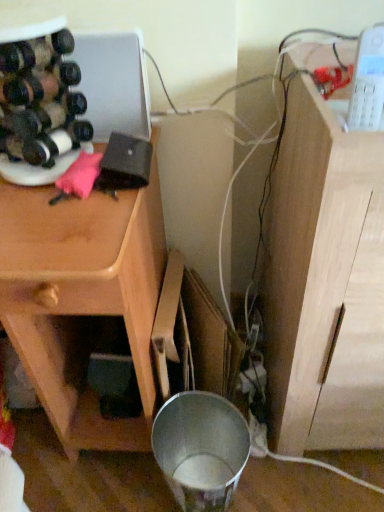
You are a GUI agent. You are given a task and a screenshot of the screen. Output one action in this format:
    pyautogui.click(x=<x>, y=<y>)
    Task: Click on the matte black wine bottle at left, arranged as the first wine bottle when viewed from the top
    The width and height of the screenshot is (384, 512).
    Given the screenshot: What is the action you would take?
    pyautogui.click(x=41, y=100)

The image size is (384, 512). Describe the element at coordinates (41, 100) in the screenshot. I see `matte black wine bottle at left, arranged as the first wine bottle when viewed from the top` at that location.

Image resolution: width=384 pixels, height=512 pixels. Identify the location of matte black wine bottle at left, the second wine bottle when ordered from top to bottom. (56, 143).

Would you say wooden cabinet at left contains light wood cabinet at right?

No, light wood cabinet at right is located outside of wooden cabinet at left.

Is wooden cabinet at left directly adjacent to light wood cabinet at right?

No, wooden cabinet at left is not next to light wood cabinet at right.

From the image's perspective, is wooden cabinet at left on top of light wood cabinet at right?

Actually, wooden cabinet at left appears below light wood cabinet at right in the image.

Can you confirm if wooden cabinet at left is thinner than light wood cabinet at right?

Correct, the width of wooden cabinet at left is less than that of light wood cabinet at right.

Identify the location of vanity in front of the matte black wine bottle at left, the second wine bottle when ordered from top to bottom. Image resolution: width=384 pixels, height=512 pixels. (325, 283).

From the picture: Does matte black wine bottle at left, positioned as the 1th wine bottle in bottom-to-top order, have a greater width compared to light wood cabinet at right?

No, matte black wine bottle at left, positioned as the 1th wine bottle in bottom-to-top order, is not wider than light wood cabinet at right.

In the image, is matte black wine bottle at left, positioned as the 1th wine bottle in bottom-to-top order, on the left side or the right side of light wood cabinet at right?

Based on their positions, matte black wine bottle at left, positioned as the 1th wine bottle in bottom-to-top order, is located to the left of light wood cabinet at right.

Which of these two, matte black wine bottle at left, positioned as the 1th wine bottle in bottom-to-top order, or light wood cabinet at right, is smaller?

With smaller size is matte black wine bottle at left, positioned as the 1th wine bottle in bottom-to-top order.

Considering the sizes of matte black wine bottle at left, arranged as the first wine bottle when viewed from the top, and light wood cabinet at right in the image, is matte black wine bottle at left, arranged as the first wine bottle when viewed from the top, bigger or smaller than light wood cabinet at right?

matte black wine bottle at left, arranged as the first wine bottle when viewed from the top, is smaller than light wood cabinet at right.

In the image, there is a matte black wine bottle at left, arranged as the first wine bottle when viewed from the top. At what (x,y) coordinates should I click in order to perform the action: click on vanity below it (from a real-world perspective). Please return your answer as a coordinate pair (x, y). This screenshot has width=384, height=512. Looking at the image, I should click on (325, 283).

Could light wood cabinet at right be considered to be inside matte black wine bottle at left, the 2th wine bottle in the bottom-to-top sequence?

No, light wood cabinet at right is not a part of matte black wine bottle at left, the 2th wine bottle in the bottom-to-top sequence.

From a real-world perspective, relative to light wood cabinet at right, is matte black wine bottle at left, the 2th wine bottle in the bottom-to-top sequence, vertically above or below?

In terms of real-world spatial position, matte black wine bottle at left, the 2th wine bottle in the bottom-to-top sequence, is above light wood cabinet at right.

Considering the relative sizes of light wood cabinet at right and wooden cabinet at left in the image provided, is light wood cabinet at right smaller than wooden cabinet at left?

Correct, light wood cabinet at right occupies less space than wooden cabinet at left.

From a real-world perspective, which is physically below, light wood cabinet at right or wooden cabinet at left?

In real-world perspective, wooden cabinet at left is lower.

Is point (327, 382) more distant than point (39, 270)?

Yes, point (327, 382) is behind point (39, 270).

Is light wood cabinet at right not close to wooden cabinet at left?

No, light wood cabinet at right is in close proximity to wooden cabinet at left.

From a real-world perspective, which is physically below, matte black wine bottle at left, positioned as the 1th wine bottle in bottom-to-top order, or wooden cabinet at left?

wooden cabinet at left.

Is matte black wine bottle at left, positioned as the 1th wine bottle in bottom-to-top order, aimed at wooden cabinet at left?

Yes, matte black wine bottle at left, positioned as the 1th wine bottle in bottom-to-top order, faces towards wooden cabinet at left.

From the image's perspective, is matte black wine bottle at left, the second wine bottle when ordered from top to bottom, above or below wooden cabinet at left?

From the image's perspective, matte black wine bottle at left, the second wine bottle when ordered from top to bottom, appears above wooden cabinet at left.

Which point is more distant from viewer, (340,293) or (71,148)?

The point (71,148) is behind.

From their relative heights in the image, would you say light wood cabinet at right is taller or shorter than matte black wine bottle at left, the 2th wine bottle in the bottom-to-top sequence?

Clearly, light wood cabinet at right is taller compared to matte black wine bottle at left, the 2th wine bottle in the bottom-to-top sequence.

From the image's perspective, is light wood cabinet at right above or below matte black wine bottle at left, the 2th wine bottle in the bottom-to-top sequence?

Based on their image positions, light wood cabinet at right is located beneath matte black wine bottle at left, the 2th wine bottle in the bottom-to-top sequence.

Based on the photo, are light wood cabinet at right and matte black wine bottle at left, the 2th wine bottle in the bottom-to-top sequence, beside each other?

They are not placed beside each other.

Considering the sizes of objects matte black wine bottle at left, the 2th wine bottle in the bottom-to-top sequence, and matte black wine bottle at left, the second wine bottle when ordered from top to bottom, in the image provided, who is wider, matte black wine bottle at left, the 2th wine bottle in the bottom-to-top sequence, or matte black wine bottle at left, the second wine bottle when ordered from top to bottom,?

Wider between the two is matte black wine bottle at left, the 2th wine bottle in the bottom-to-top sequence.

From their relative heights in the image, would you say matte black wine bottle at left, the 2th wine bottle in the bottom-to-top sequence, is taller or shorter than matte black wine bottle at left, positioned as the 1th wine bottle in bottom-to-top order?

Clearly, matte black wine bottle at left, the 2th wine bottle in the bottom-to-top sequence, is taller compared to matte black wine bottle at left, positioned as the 1th wine bottle in bottom-to-top order.

Is matte black wine bottle at left, the 2th wine bottle in the bottom-to-top sequence, touching matte black wine bottle at left, the second wine bottle when ordered from top to bottom?

Yes, matte black wine bottle at left, the 2th wine bottle in the bottom-to-top sequence, is with matte black wine bottle at left, the second wine bottle when ordered from top to bottom.

At what (x,y) coordinates should I click in order to perform the action: click on vanity above the wooden cabinet at left (from the image's perspective). Please return your answer as a coordinate pair (x, y). This screenshot has width=384, height=512. Looking at the image, I should click on (325, 283).

Find the location of a particular element. The image size is (384, 512). vanity below the matte black wine bottle at left, the second wine bottle when ordered from top to bottom (from the image's perspective) is located at coordinates (325, 283).

Which object lies further to the anchor point matte black wine bottle at left, positioned as the 1th wine bottle in bottom-to-top order, matte black wine bottle at left, arranged as the first wine bottle when viewed from the top, or wooden cabinet at left?

wooden cabinet at left is positioned further to the anchor matte black wine bottle at left, positioned as the 1th wine bottle in bottom-to-top order.

Which object lies further to the anchor point matte black wine bottle at left, the second wine bottle when ordered from top to bottom, matte black wine bottle at left, arranged as the first wine bottle when viewed from the top, or light wood cabinet at right?

light wood cabinet at right.

Estimate the real-world distances between objects in this image. Which object is closer to matte black wine bottle at left, arranged as the first wine bottle when viewed from the top, light wood cabinet at right or matte black wine bottle at left, positioned as the 1th wine bottle in bottom-to-top order?

The object closer to matte black wine bottle at left, arranged as the first wine bottle when viewed from the top, is matte black wine bottle at left, positioned as the 1th wine bottle in bottom-to-top order.

Looking at the image, which one is located closer to wooden cabinet at left, light wood cabinet at right or matte black wine bottle at left, positioned as the 1th wine bottle in bottom-to-top order?

matte black wine bottle at left, positioned as the 1th wine bottle in bottom-to-top order.

Looking at the image, which one is located further to matte black wine bottle at left, the 2th wine bottle in the bottom-to-top sequence, light wood cabinet at right or wooden cabinet at left?

The object further to matte black wine bottle at left, the 2th wine bottle in the bottom-to-top sequence, is light wood cabinet at right.

Which object lies nearer to the anchor point wooden cabinet at left, light wood cabinet at right or matte black wine bottle at left, arranged as the first wine bottle when viewed from the top?

matte black wine bottle at left, arranged as the first wine bottle when viewed from the top.

Estimate the real-world distances between objects in this image. Which object is further from light wood cabinet at right, matte black wine bottle at left, the 2th wine bottle in the bottom-to-top sequence, or matte black wine bottle at left, the second wine bottle when ordered from top to bottom?

The object further to light wood cabinet at right is matte black wine bottle at left, the second wine bottle when ordered from top to bottom.

Based on their spatial positions, is matte black wine bottle at left, positioned as the 1th wine bottle in bottom-to-top order, or matte black wine bottle at left, the 2th wine bottle in the bottom-to-top sequence, further from light wood cabinet at right?

matte black wine bottle at left, positioned as the 1th wine bottle in bottom-to-top order.

Locate an element on the screen. The image size is (384, 512). wine bottle between matte black wine bottle at left, the 2th wine bottle in the bottom-to-top sequence, and light wood cabinet at right is located at coordinates tap(56, 143).

Find the location of `wine bottle between matte black wine bottle at left, arranged as the first wine bottle when viewed from the top, and wooden cabinet at left from top to bottom`. wine bottle between matte black wine bottle at left, arranged as the first wine bottle when viewed from the top, and wooden cabinet at left from top to bottom is located at coordinates (56, 143).